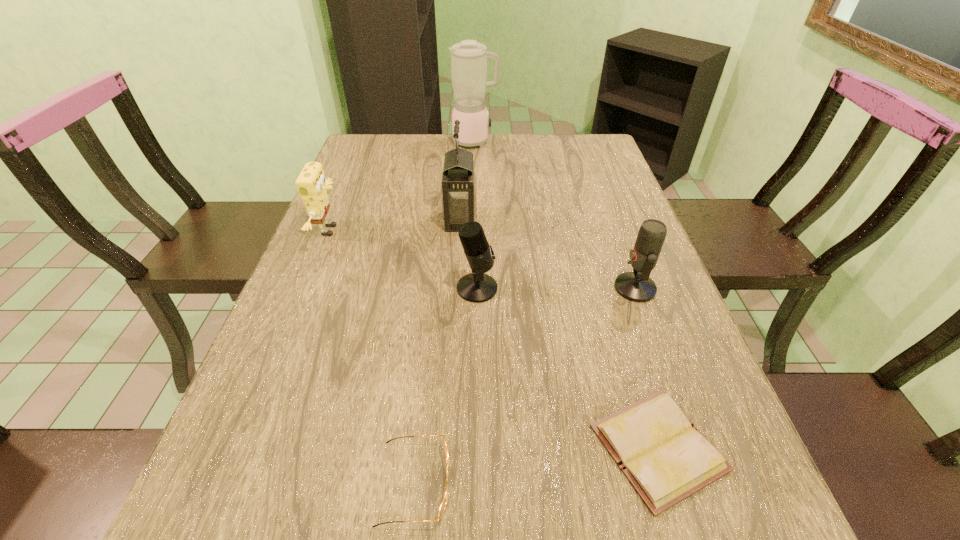
This screenshot has width=960, height=540. Find the location of `free space that satisfies the following two spatial constraints: 1. on the front side of the shortest object; 2. on the front-facing side of the second shortest object`. free space that satisfies the following two spatial constraints: 1. on the front side of the shortest object; 2. on the front-facing side of the second shortest object is located at coordinates (669, 483).

Locate an element on the screen. Image resolution: width=960 pixels, height=540 pixels. vacant point that satisfies the following two spatial constraints: 1. on the face of the leftmost object; 2. on the left side of the diary is located at coordinates (242, 448).